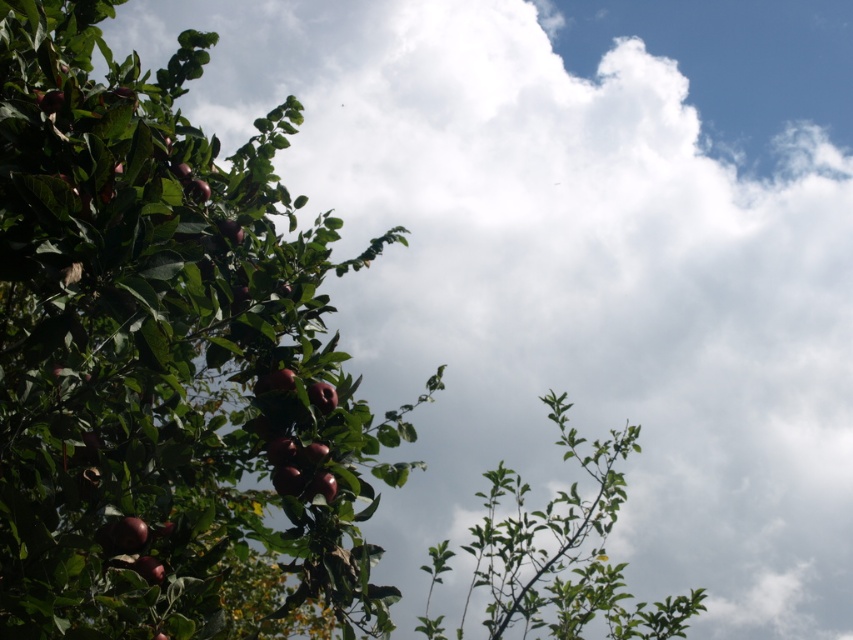
Can you confirm if glossy red apples at left is positioned to the left of green leafy branch at center?

Correct, you'll find glossy red apples at left to the left of green leafy branch at center.

Where is `glossy red apples at left`? The image size is (853, 640). glossy red apples at left is located at coordinates 166,360.